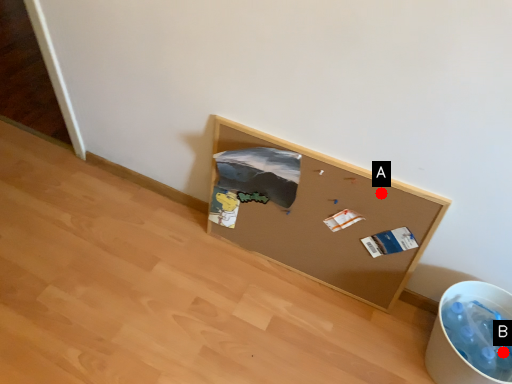
Question: Two points are circled on the image, labeled by A and B beside each circle. Which point is farther to the camera?

Choices:
 (A) A is further
 (B) B is further

Answer: (A)